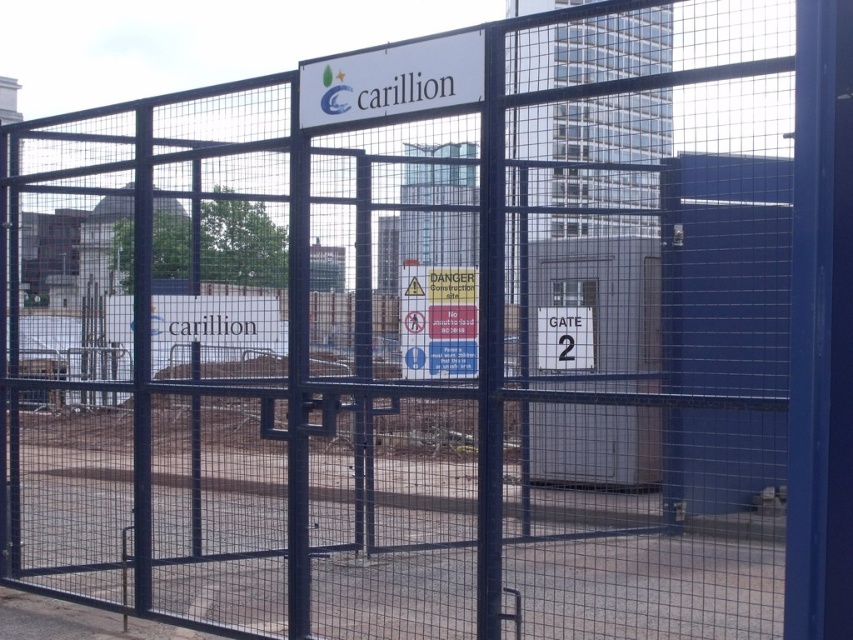
You are a delivery driver approaching the construction site and need to locate the entrance. You see the white plastic sign at upper center and the white plastic gate at center. According to the scene, which object is positioned to the left of the other?

The white plastic sign at upper center is to the left of the white plastic gate at center, so the sign is positioned to the left of the gate.

You are a delivery driver approaching the construction site and need to locate the warning signs. According to the scene, which sign is smaller in size between the white plastic sign at upper center and the white plastic sign at center?

The white plastic sign at upper center is smaller in size than the white plastic sign at center because it occupies less space.

Consider the image. You are standing in front of the construction site fence. You need to locate the white plastic sign at upper center. Where should you look relative to the metal fence?

The white plastic sign at upper center is located at the upper center position on the metal fence.